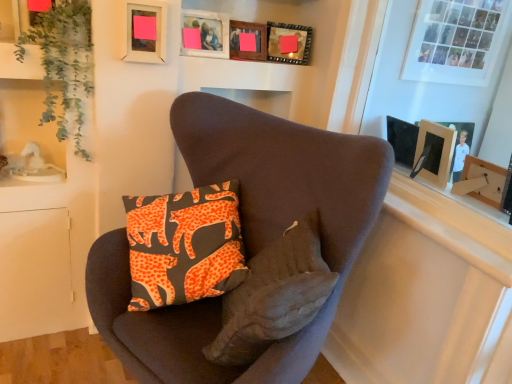
At what (x,y) coordinates should I click in order to perform the action: click on orange printed fabric pillow at center. Please return your answer as a coordinate pair (x, y). The height and width of the screenshot is (384, 512). Looking at the image, I should click on (274, 295).

What is the approximate width of matte wooden picture frame at upper center, the 3th picture frame positioned from the right?

It is 2.43 inches.

Describe the element at coordinates (288, 43) in the screenshot. The height and width of the screenshot is (384, 512). I see `wooden picture frame at upper center, marked as the first picture frame in a right-to-left arrangement` at that location.

Where is `matte white photo frame at upper right`? Image resolution: width=512 pixels, height=384 pixels. matte white photo frame at upper right is located at coordinates (455, 41).

Image resolution: width=512 pixels, height=384 pixels. What are the coordinates of `green leafy plant at upper left` in the screenshot? It's located at (63, 63).

Which object is thinner, matte wooden picture frame at upper center, which is counted as the 2th picture frame, starting from the left, or wooden picture frame at upper center, the 2th picture frame from the right?

wooden picture frame at upper center, the 2th picture frame from the right.

Does point (189, 15) come closer to viewer compared to point (256, 52)?

Yes, it is.

Could you tell me if matte wooden picture frame at upper center, the 3th picture frame positioned from the right, is turned towards wooden picture frame at upper center, the third picture frame viewed from the left?

No, matte wooden picture frame at upper center, the 3th picture frame positioned from the right, is not oriented towards wooden picture frame at upper center, the third picture frame viewed from the left.

Considering the positions of objects matte wooden picture frame at upper center, which is counted as the 2th picture frame, starting from the left, and wooden picture frame at upper center, the 2th picture frame from the right, in the image provided, who is more to the right, matte wooden picture frame at upper center, which is counted as the 2th picture frame, starting from the left, or wooden picture frame at upper center, the 2th picture frame from the right,?

wooden picture frame at upper center, the 2th picture frame from the right, is more to the right.

From the image's perspective, is wooden picture frame at upper center, marked as the first picture frame in a right-to-left arrangement, over matte white photo frame at upper right?

Actually, wooden picture frame at upper center, marked as the first picture frame in a right-to-left arrangement, appears below matte white photo frame at upper right in the image.

In the scene shown: Could you tell me if wooden picture frame at upper center, marked as the first picture frame in a right-to-left arrangement, is facing matte white photo frame at upper right?

No, wooden picture frame at upper center, marked as the first picture frame in a right-to-left arrangement, is not facing towards matte white photo frame at upper right.

You are a GUI agent. You are given a task and a screenshot of the screen. Output one action in this format:
    pyautogui.click(x=<x>, y=<y>)
    Task: Click on the bay window that appears above the wooden picture frame at upper center, marked as the first picture frame in a right-to-left arrangement (from the image's perspective)
    Image resolution: width=512 pixels, height=384 pixels.
    Given the screenshot: What is the action you would take?
    pyautogui.click(x=455, y=41)

How many degrees apart are the facing directions of wooden picture frame at upper center, marked as the first picture frame in a right-to-left arrangement, and matte white photo frame at upper right?

They differ by 40.1 degrees in their facing directions.

From the picture: From a real-world perspective, is matte plastic picture frame at upper center, the 4th picture frame from the right, positioned above or below matte white photo frame at upper right?

In terms of real-world spatial position, matte plastic picture frame at upper center, the 4th picture frame from the right, is below matte white photo frame at upper right.

Does matte plastic picture frame at upper center, the 4th picture frame from the right, have a greater height compared to matte white photo frame at upper right?

In fact, matte plastic picture frame at upper center, the 4th picture frame from the right, may be shorter than matte white photo frame at upper right.

Identify the location of the 3rd picture frame located beneath the matte white photo frame at upper right (from a real-world perspective). The image size is (512, 384). (145, 31).

Measure the distance from matte plastic picture frame at upper center, the 4th picture frame from the right, to wooden picture frame at upper center, the third picture frame viewed from the left.

matte plastic picture frame at upper center, the 4th picture frame from the right, is 16.79 inches from wooden picture frame at upper center, the third picture frame viewed from the left.

Consider the image. Which object is wider, matte plastic picture frame at upper center, the 4th picture frame from the right, or wooden picture frame at upper center, the third picture frame viewed from the left?

wooden picture frame at upper center, the third picture frame viewed from the left.

Is matte plastic picture frame at upper center, the 4th picture frame from the right, in front of or behind wooden picture frame at upper center, the 2th picture frame from the right, in the image?

Clearly, matte plastic picture frame at upper center, the 4th picture frame from the right, is in front of wooden picture frame at upper center, the 2th picture frame from the right.

From a real-world perspective, relative to wooden picture frame at upper center, the 2th picture frame from the right, is matte plastic picture frame at upper center, the 1th picture frame from the left, vertically above or below?

From a real-world perspective, matte plastic picture frame at upper center, the 1th picture frame from the left, is physically above wooden picture frame at upper center, the 2th picture frame from the right.

Between wooden picture frame at upper center, the third picture frame viewed from the left, and green leafy plant at upper left, which one is positioned behind?

wooden picture frame at upper center, the third picture frame viewed from the left.

From the image's perspective, is wooden picture frame at upper center, the third picture frame viewed from the left, above or below green leafy plant at upper left?

wooden picture frame at upper center, the third picture frame viewed from the left, is situated higher than green leafy plant at upper left in the image.

Based on their positions, is wooden picture frame at upper center, the 2th picture frame from the right, located to the left or right of green leafy plant at upper left?

wooden picture frame at upper center, the 2th picture frame from the right, is positioned on green leafy plant at upper left's right side.

Is wooden picture frame at upper center, the third picture frame viewed from the left, surrounding green leafy plant at upper left?

No, wooden picture frame at upper center, the third picture frame viewed from the left, does not contain green leafy plant at upper left.

Looking at this image, is matte white photo frame at upper right turned away from green leafy plant at upper left?

No, matte white photo frame at upper right's orientation is not away from green leafy plant at upper left.

Considering the relative sizes of matte white photo frame at upper right and green leafy plant at upper left in the image provided, is matte white photo frame at upper right taller than green leafy plant at upper left?

No, matte white photo frame at upper right is not taller than green leafy plant at upper left.

Looking at this image, between matte white photo frame at upper right and green leafy plant at upper left, which one has smaller width?

Thinner between the two is matte white photo frame at upper right.

How many degrees apart are the facing directions of matte white photo frame at upper right and green leafy plant at upper left?

1.55 degrees separate the facing orientations of matte white photo frame at upper right and green leafy plant at upper left.

Could you measure the distance between wooden picture frame at upper center, the 2th picture frame from the right, and orange printed fabric pillow at center?

They are 1.05 meters apart.

Does wooden picture frame at upper center, the third picture frame viewed from the left, turn towards orange printed fabric pillow at center?

No, wooden picture frame at upper center, the third picture frame viewed from the left, is not turned towards orange printed fabric pillow at center.

From the image's perspective, is wooden picture frame at upper center, the third picture frame viewed from the left, beneath orange printed fabric pillow at center?

No, from the image's perspective, wooden picture frame at upper center, the third picture frame viewed from the left, is not beneath orange printed fabric pillow at center.

Does wooden picture frame at upper center, the 2th picture frame from the right, appear on the left side of orange printed fabric pillow at center?

Yes.

Find the location of a particular element. This screenshot has height=384, width=512. picture frame that is the 1st one when counting backward from the matte wooden picture frame at upper center, the 3th picture frame positioned from the right is located at coordinates (247, 40).

Image resolution: width=512 pixels, height=384 pixels. I want to click on the 1st picture frame below the matte white photo frame at upper right (from the image's perspective), so click(x=288, y=43).

From the image, which object appears to be nearer to green leafy plant at upper left, velvet brown armchair at center or wooden picture frame at upper center, the third picture frame viewed from the left?

velvet brown armchair at center.

Looking at the image, which one is located closer to orange printed fabric pillow at center, matte plastic picture frame at upper center, the 4th picture frame from the right, or wooden picture frame at upper center, the third picture frame viewed from the left?

matte plastic picture frame at upper center, the 4th picture frame from the right, lies closer to orange printed fabric pillow at center than the other object.

From the picture: Estimate the real-world distances between objects in this image. Which object is further from matte wooden picture frame at upper center, which is counted as the 2th picture frame, starting from the left, wooden picture frame at upper center, the 2th picture frame from the right, or wooden picture frame at upper center, placed as the fourth picture frame when sorted from left to right?

Based on the image, wooden picture frame at upper center, placed as the fourth picture frame when sorted from left to right, appears to be further to matte wooden picture frame at upper center, which is counted as the 2th picture frame, starting from the left.

Estimate the real-world distances between objects in this image. Which object is further from matte wooden picture frame at upper center, which is counted as the 2th picture frame, starting from the left, velvet brown armchair at center or wooden picture frame at upper center, the 2th picture frame from the right?

Among the two, velvet brown armchair at center is located further to matte wooden picture frame at upper center, which is counted as the 2th picture frame, starting from the left.

Estimate the real-world distances between objects in this image. Which object is further from orange printed fabric pillow at center, matte wooden picture frame at upper center, the 3th picture frame positioned from the right, or velvet brown armchair at center?

matte wooden picture frame at upper center, the 3th picture frame positioned from the right.

Which object lies nearer to the anchor point matte white photo frame at upper right, matte plastic picture frame at upper center, the 1th picture frame from the left, or orange printed fabric pillow at center?

orange printed fabric pillow at center is closer to matte white photo frame at upper right.

Looking at the image, which one is located closer to wooden picture frame at upper center, the 2th picture frame from the right, orange printed fabric pillow at center or green leafy plant at upper left?

green leafy plant at upper left.

Looking at the image, which one is located closer to matte wooden picture frame at upper center, which is counted as the 2th picture frame, starting from the left, green leafy plant at upper left or matte white photo frame at upper right?

green leafy plant at upper left is positioned closer to the anchor matte wooden picture frame at upper center, which is counted as the 2th picture frame, starting from the left.

Identify the location of plant that lies between matte plastic picture frame at upper center, the 4th picture frame from the right, and orange printed fabric pillow at center from top to bottom. [63, 63].

Image resolution: width=512 pixels, height=384 pixels. I want to click on picture frame located between wooden picture frame at upper center, the third picture frame viewed from the left, and matte white photo frame at upper right in the left-right direction, so click(288, 43).

You are a GUI agent. You are given a task and a screenshot of the screen. Output one action in this format:
    pyautogui.click(x=<x>, y=<y>)
    Task: Click on the chair situated between green leafy plant at upper left and matte white photo frame at upper right from left to right
    The width and height of the screenshot is (512, 384).
    Given the screenshot: What is the action you would take?
    pyautogui.click(x=245, y=236)

I want to click on plant that lies between wooden picture frame at upper center, placed as the fourth picture frame when sorted from left to right, and orange printed fabric pillow at center from top to bottom, so click(63, 63).